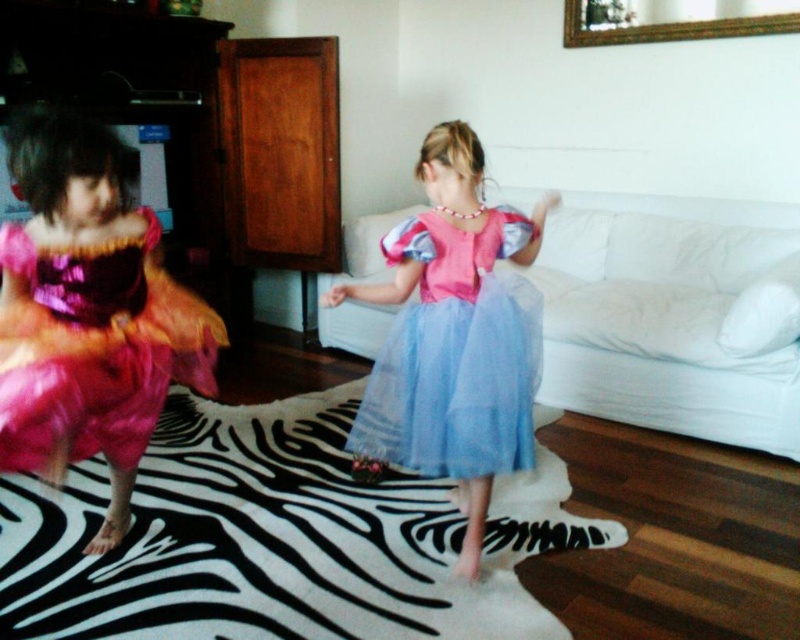
Can you confirm if shiny blue tulle dress at center is wider than pink tulle dress at center?

Indeed, shiny blue tulle dress at center has a greater width compared to pink tulle dress at center.

Where is `shiny blue tulle dress at center`? This screenshot has height=640, width=800. shiny blue tulle dress at center is located at coordinates (450, 339).

This screenshot has height=640, width=800. Describe the element at coordinates (96, 349) in the screenshot. I see `shiny pink dress at left` at that location.

Is point (38, 364) positioned behind point (420, 413)?

No, it is not.

Between point (145, 234) and point (444, 397), which one is positioned in front?

Point (145, 234) is in front.

Locate an element on the screen. This screenshot has height=640, width=800. shiny pink dress at left is located at coordinates (96, 349).

Which is behind, point (492, 248) or point (34, 449)?

Positioned behind is point (492, 248).

Locate an element on the screen. This screenshot has height=640, width=800. shiny blue tulle dress at center is located at coordinates (450, 339).

You are a GUI agent. You are given a task and a screenshot of the screen. Output one action in this format:
    pyautogui.click(x=<x>, y=<y>)
    Task: Click on the shiny blue tulle dress at center
    The height and width of the screenshot is (640, 800).
    Given the screenshot: What is the action you would take?
    pyautogui.click(x=450, y=339)